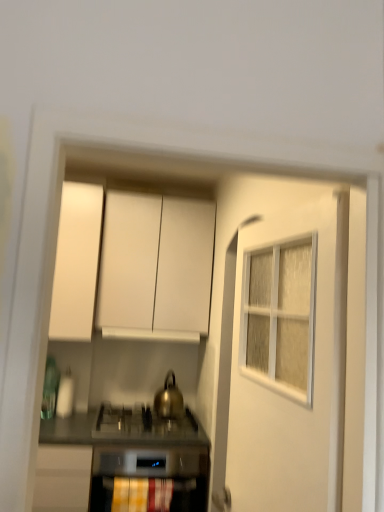
Question: Is gold metallic kettle at center oriented away from metallic stainless steel countertop at center?

Choices:
 (A) yes
 (B) no

Answer: (B)

Question: Is gold metallic kettle at center in contact with metallic stainless steel countertop at center?

Choices:
 (A) yes
 (B) no

Answer: (B)

Question: Can you confirm if gold metallic kettle at center is thinner than metallic stainless steel countertop at center?

Choices:
 (A) yes
 (B) no

Answer: (A)

Question: Could you tell me if gold metallic kettle at center is facing metallic stainless steel countertop at center?

Choices:
 (A) no
 (B) yes

Answer: (A)

Question: Is gold metallic kettle at center shorter than metallic stainless steel countertop at center?

Choices:
 (A) yes
 (B) no

Answer: (B)

Question: Considering the positions of point (175, 415) and point (109, 336), is point (175, 415) closer or farther from the camera than point (109, 336)?

Choices:
 (A) farther
 (B) closer

Answer: (B)

Question: Would you say gold metallic kettle at center is to the left or to the right of white matte vent at center in the picture?

Choices:
 (A) right
 (B) left

Answer: (A)

Question: Based on their sizes in the image, would you say gold metallic kettle at center is bigger or smaller than white matte vent at center?

Choices:
 (A) big
 (B) small

Answer: (B)

Question: In terms of width, does gold metallic kettle at center look wider or thinner when compared to white matte vent at center?

Choices:
 (A) wide
 (B) thin

Answer: (B)

Question: From their relative heights in the image, would you say yellow fabric curtain at lower center is taller or shorter than white textured door at center?

Choices:
 (A) short
 (B) tall

Answer: (A)

Question: In the image, is yellow fabric curtain at lower center on the left side or the right side of white textured door at center?

Choices:
 (A) right
 (B) left

Answer: (B)

Question: Which is correct: yellow fabric curtain at lower center is inside white textured door at center, or outside of it?

Choices:
 (A) inside
 (B) outside

Answer: (B)

Question: From a real-world perspective, is yellow fabric curtain at lower center positioned above or below white textured door at center?

Choices:
 (A) below
 (B) above

Answer: (A)

Question: Relative to gold metallic kettle at center, is yellow fabric curtain at lower center in front or behind?

Choices:
 (A) front
 (B) behind

Answer: (A)

Question: Is point (160, 502) closer or farther from the camera than point (180, 408)?

Choices:
 (A) farther
 (B) closer

Answer: (A)